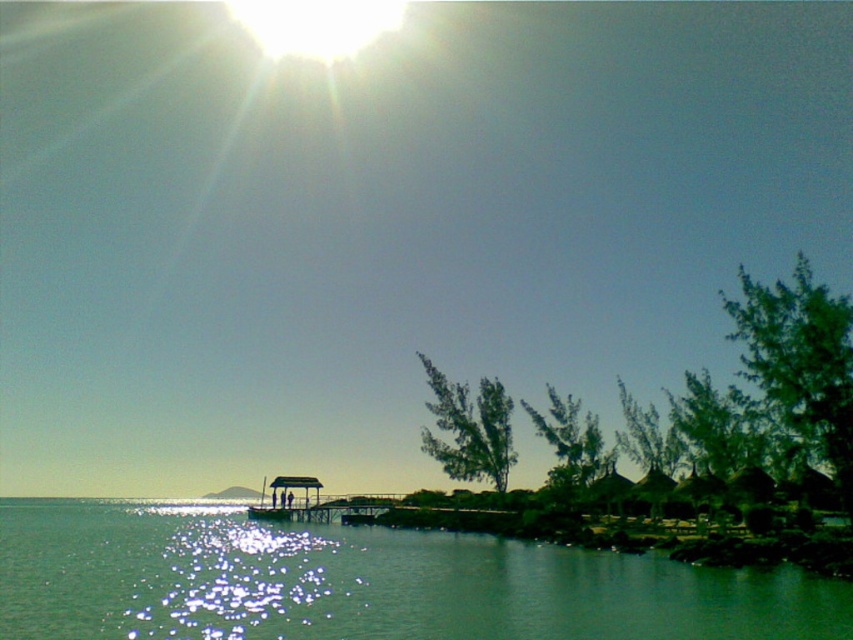
You are standing at the edge of the wooden pier on the right side of the image. You want to walk towards the green glossy water at center. Is the water directly in front of you or to your left or right?

The green glossy water at center is located at point (x=367, y=582), which is to the right of your position on the wooden pier. Therefore, you should walk to your right to reach the green glossy water at center.

You are standing on the wooden pier at center and want to see the green glossy water at center. In which direction should you look relative to the pier?

Since the green glossy water at center is in front of the wooden pier at center, you should look forward towards the direction the pier is extending into the water to see the green glossy water at center.